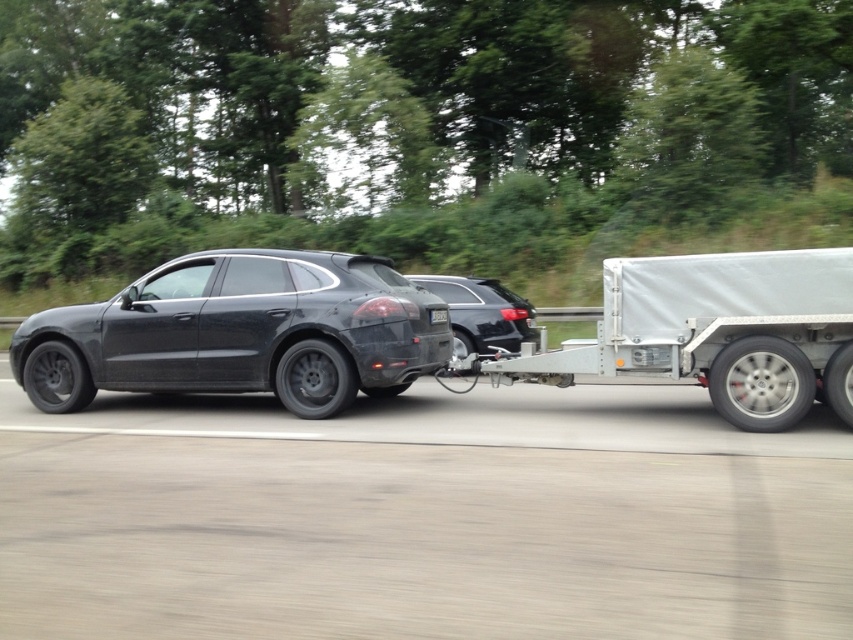
Question: Which object appears farthest from the camera in this image?

Choices:
 (A) matte black suv at left
 (B) satin black car at center

Answer: (B)

Question: Which of the following is the closest to the observer?

Choices:
 (A) matte black suv at left
 (B) silver metallic trailer at right

Answer: (B)

Question: Is matte black suv at left smaller than silver metallic trailer at right?

Choices:
 (A) yes
 (B) no

Answer: (A)

Question: Can you confirm if matte black suv at left is positioned above satin black car at center?

Choices:
 (A) yes
 (B) no

Answer: (B)

Question: Is matte black suv at left below silver metallic trailer at right?

Choices:
 (A) no
 (B) yes

Answer: (A)

Question: Which of the following is the closest to the observer?

Choices:
 (A) (288, 298)
 (B) (477, 278)

Answer: (A)